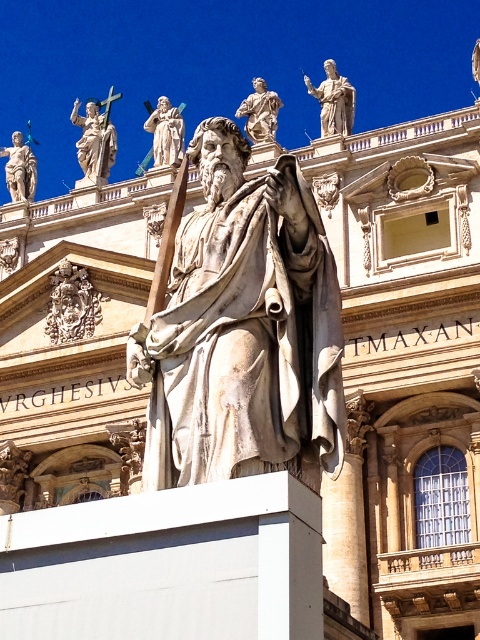
Question: Which point appears farthest from the camera in this image?

Choices:
 (A) [96, 115]
 (B) [68, 280]

Answer: (A)

Question: Does polished marble statue at upper left appear on the right side of white marble statue at upper center?

Choices:
 (A) no
 (B) yes

Answer: (A)

Question: Which point is closer to the camera taking this photo?

Choices:
 (A) (251, 112)
 (B) (170, 296)
 (C) (347, 92)
 (D) (14, 147)

Answer: (B)

Question: Which point is farther to the camera?

Choices:
 (A) carved stone relief at upper left
 (B) white marble statue at upper center
 (C) white marble statue at center
 (D) polished marble statue at upper left

Answer: (D)

Question: Does carved stone relief at upper left have a lesser width compared to matte gray statue at upper left?

Choices:
 (A) no
 (B) yes

Answer: (B)

Question: Does white marble statue at upper center appear on the left side of polished bronze statue at upper center?

Choices:
 (A) no
 (B) yes

Answer: (A)